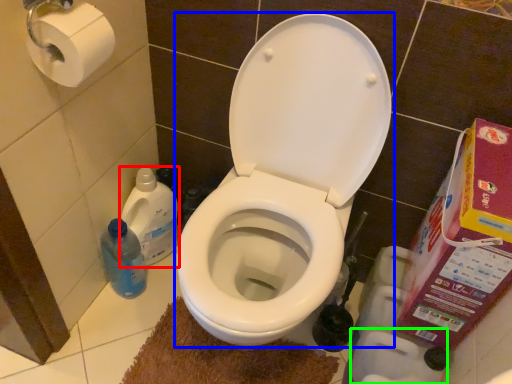
Question: Based on their relative distances, which object is nearer to cleaning product (highlighted by a red box)? Choose from toilet (highlighted by a blue box) and toilet paper (highlighted by a green box).

Choices:
 (A) toilet
 (B) toilet paper

Answer: (A)